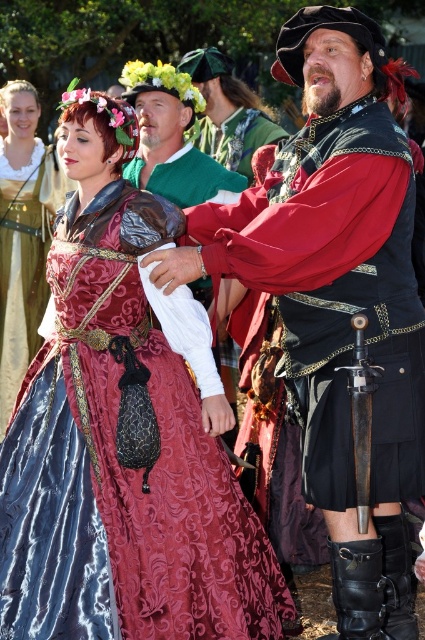
Question: Which is nearer to the velvet red kilt at center?

Choices:
 (A) velvet black vest at center
 (B) matte black kilt at center
 (C) velvet maroon dress at center

Answer: (B)

Question: Estimate the real-world distances between objects in this image. Which object is closer to the velvet red kilt at center?

Choices:
 (A) matte black kilt at center
 (B) velvet burgundy gown at center
 (C) velvet maroon dress at center
 (D) velvet black vest at center

Answer: (A)

Question: Which object is closer to the camera taking this photo?

Choices:
 (A) matte black kilt at center
 (B) velvet burgundy gown at center
 (C) velvet black vest at center
 (D) velvet maroon dress at center

Answer: (B)

Question: Does velvet maroon dress at center appear under matte black kilt at center?

Choices:
 (A) no
 (B) yes

Answer: (B)

Question: Can you confirm if velvet burgundy gown at center is bigger than velvet maroon dress at center?

Choices:
 (A) yes
 (B) no

Answer: (A)

Question: Is velvet burgundy gown at center smaller than velvet red kilt at center?

Choices:
 (A) no
 (B) yes

Answer: (A)